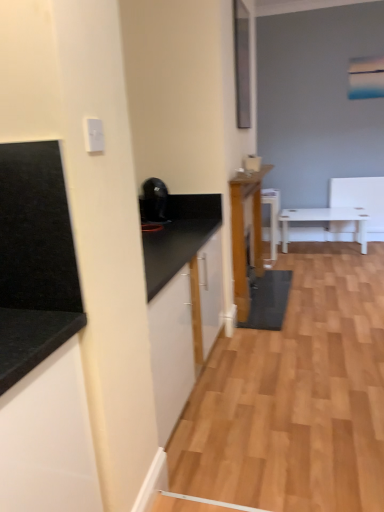
Question: Considering the positions of point (31, 317) and point (157, 218), is point (31, 317) closer or farther from the camera than point (157, 218)?

Choices:
 (A) farther
 (B) closer

Answer: (B)

Question: Is black granite countertop at left, which appears as the second countertop when viewed from the front, bigger or smaller than black glossy coffee maker at upper center?

Choices:
 (A) small
 (B) big

Answer: (B)

Question: Which object is positioned farthest from the black granite countertop at left, which appears as the first countertop when viewed from the back?

Choices:
 (A) black glossy coffee maker at upper center
 (B) black granite countertop at left, the first countertop in the front-to-back sequence
 (C) black granite countertop at left, which ranks as the first cabinetry in front-to-back order
 (D) wooden cabinet at center, which is the first cabinetry from back to front

Answer: (D)

Question: Estimate the real-world distances between objects in this image. Which object is closer to the black granite countertop at left, which appears as the first countertop when viewed from the back?

Choices:
 (A) black granite countertop at left, which is the 1th cabinetry in left-to-right order
 (B) black glossy coffee maker at upper center
 (C) wooden cabinet at center, acting as the second cabinetry starting from the left
 (D) black granite countertop at left, placed as the second countertop when sorted from back to front

Answer: (B)